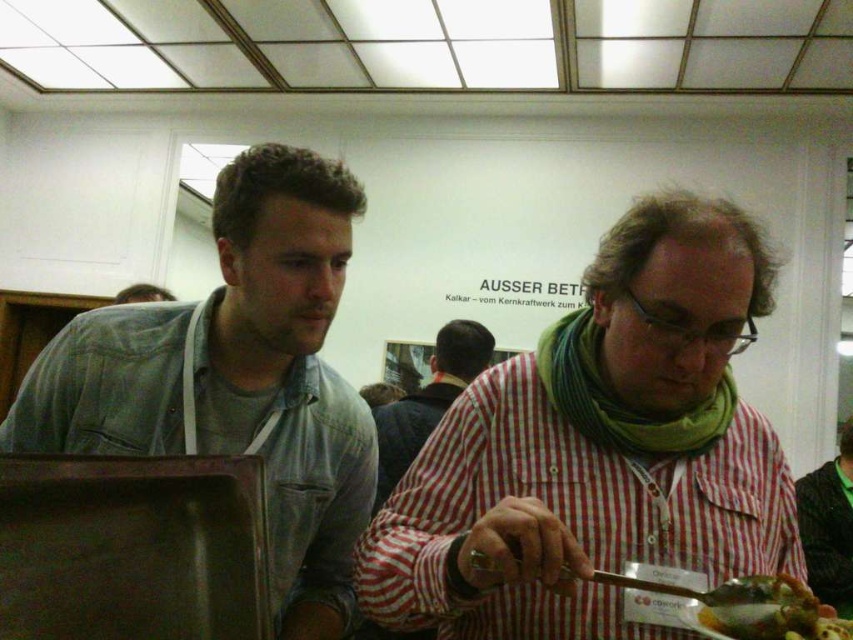
Question: Does red plaid shirt at center appear on the right side of red checkered shirt at center?

Choices:
 (A) yes
 (B) no

Answer: (A)

Question: Which point is closer to the camera?

Choices:
 (A) green leafy vegetable at lower right
 (B) denim shirt at left
 (C) red checkered shirt at center
 (D) green knitted scarf at lower right

Answer: (A)

Question: Estimate the real-world distances between objects in this image. Which object is closer to the green knitted scarf at lower right?

Choices:
 (A) red plaid shirt at center
 (B) red checkered shirt at center
 (C) green leafy vegetable at lower right
 (D) denim shirt at left

Answer: (B)

Question: Which object is the farthest from the green leafy vegetable at lower right?

Choices:
 (A) denim shirt at left
 (B) green knitted scarf at lower right

Answer: (B)

Question: Is red checkered shirt at center further to the viewer compared to green leafy vegetable at lower right?

Choices:
 (A) no
 (B) yes

Answer: (B)

Question: Is denim shirt at left bigger than green leafy vegetable at lower right?

Choices:
 (A) no
 (B) yes

Answer: (B)